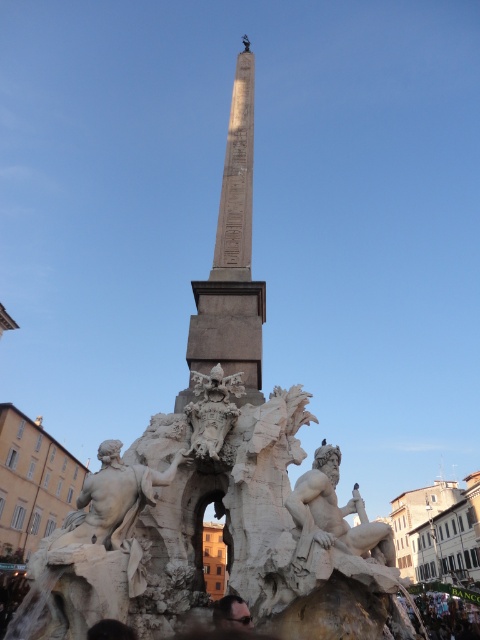
You are an architect designing a new plaza and want to place a new statue between the white stone obelisk at center and the white stone sculpture at center. Which object should the statue be placed closer to if the obelisk is wider than the sculpture?

The statue should be placed closer to the white stone sculpture at center because the white stone obelisk at center is wider, so positioning the statue nearer to the narrower sculpture would maintain balance in the design.

You are standing in front of the grand architectural structure and want to find the white stone figure at center. Based on the coordinates provided in the description, can you determine its position relative to the fountain and the seated statues?

The white stone figure at center is located at coordinates point [335,513], which places it near the base of the obelisk, centrally positioned between the two seated statues of muscular, nude male figures on either side of the fountain.

You are standing at the entrance of the structure and want to locate the white stone sculpture at center. According to the coordinates provided, where should you look relative to your current position?

The white stone sculpture at center is located at coordinates point (213, 410), which means it is positioned to the right and slightly above your current line of sight from the entrance.